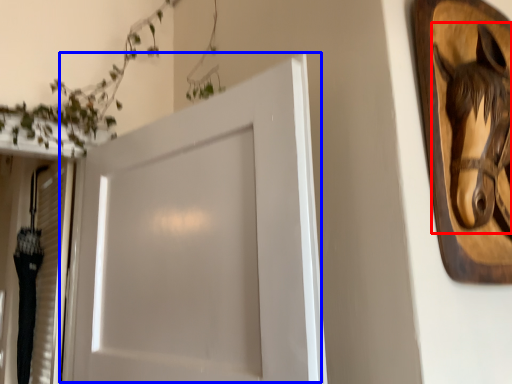
Question: Which object is further to the camera taking this photo, animal (highlighted by a red box) or door (highlighted by a blue box)?

Choices:
 (A) animal
 (B) door

Answer: (A)